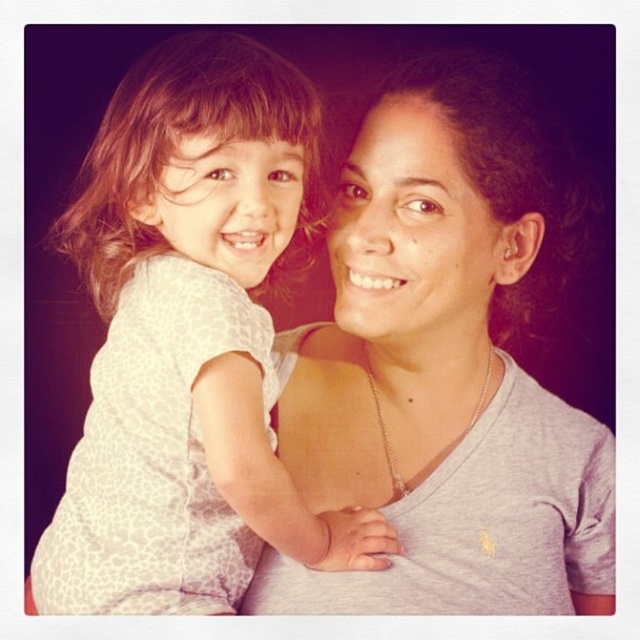
Is point (339, 577) behind point (275, 522)?

Yes.

Is point (518, 544) positioned before point (104, 204)?

Yes, it is.

The height and width of the screenshot is (640, 640). Find the location of `gray matte shirt at center`. gray matte shirt at center is located at coordinates (445, 364).